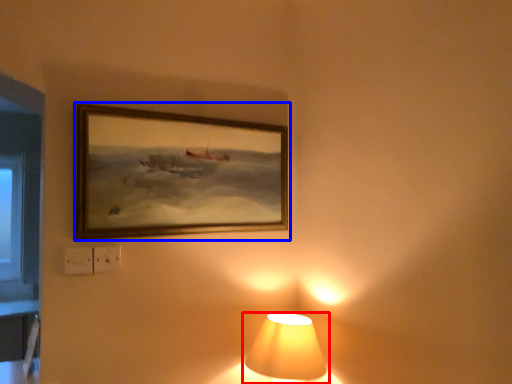
Question: Which of the following is the closest to the observer, lamp (highlighted by a red box) or picture frame (highlighted by a blue box)?

Choices:
 (A) lamp
 (B) picture frame

Answer: (A)